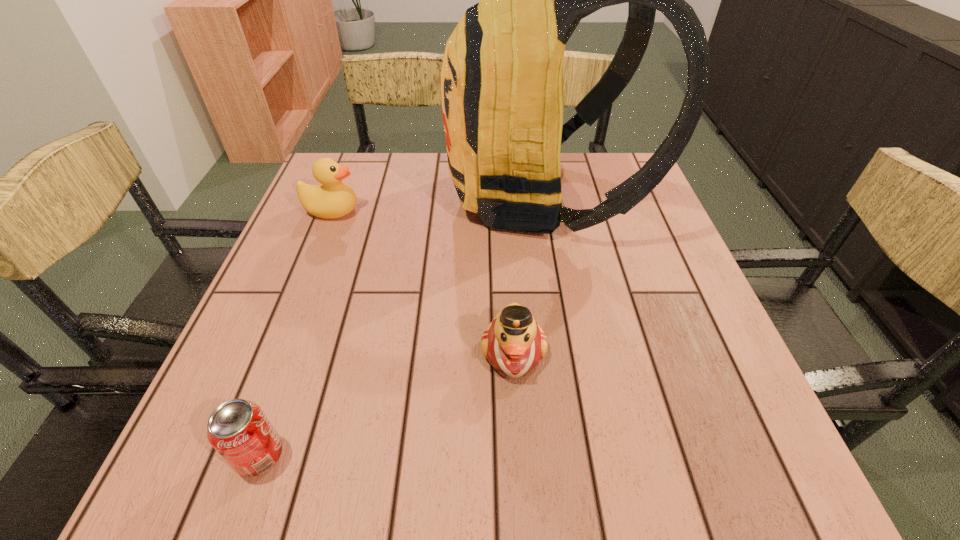
You are a GUI agent. You are given a task and a screenshot of the screen. Output one action in this format:
    pyautogui.click(x=<x>, y=<y>)
    Task: Click on the free spot located 0.220m on the right of the nearest object
    The image size is (960, 540).
    Given the screenshot: What is the action you would take?
    pyautogui.click(x=431, y=455)

Find the location of a particular element. The height and width of the screenshot is (540, 960). backpack at the far edge is located at coordinates (502, 74).

Where is `duck present at the far edge`? duck present at the far edge is located at coordinates (334, 199).

Where is `object positioned at the near edge`? object positioned at the near edge is located at coordinates [238, 429].

Find the location of a particular element. This screenshot has height=540, width=960. duck present at the left edge is located at coordinates (334, 199).

At what (x,y) coordinates should I click in order to perform the action: click on soda can that is at the left edge. Please return your answer as a coordinate pair (x, y). This screenshot has height=540, width=960. Looking at the image, I should click on (238, 429).

In order to click on object positioned at the right edge in this screenshot , I will do `click(502, 74)`.

Find the location of `object that is at the far left corner`. object that is at the far left corner is located at coordinates [x=334, y=199].

In order to click on object positioned at the near left corner in this screenshot , I will do (x=238, y=429).

Locate an element on the screen. object located at the far right corner is located at coordinates (502, 74).